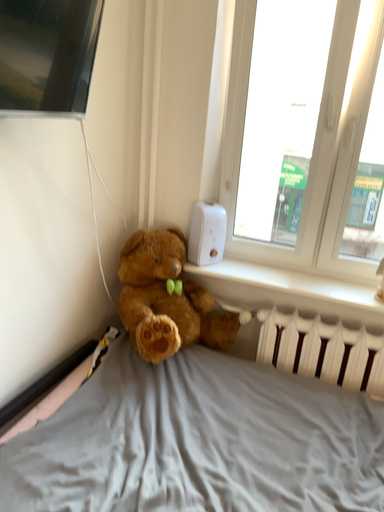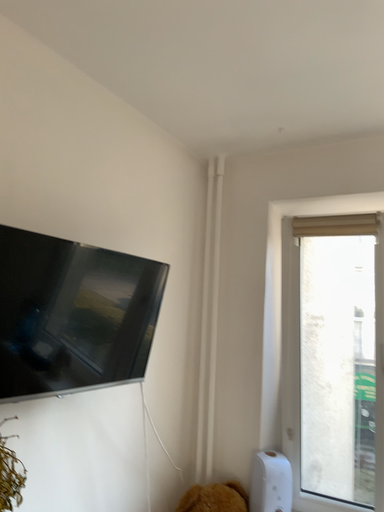
Question: How did the camera likely rotate when shooting the video?

Choices:
 (A) rotated right
 (B) rotated left

Answer: (B)